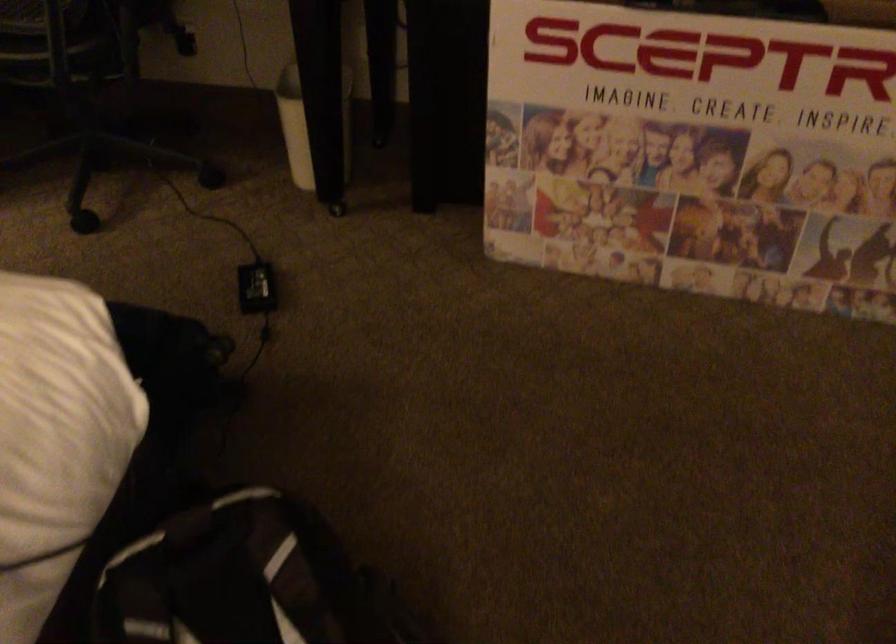
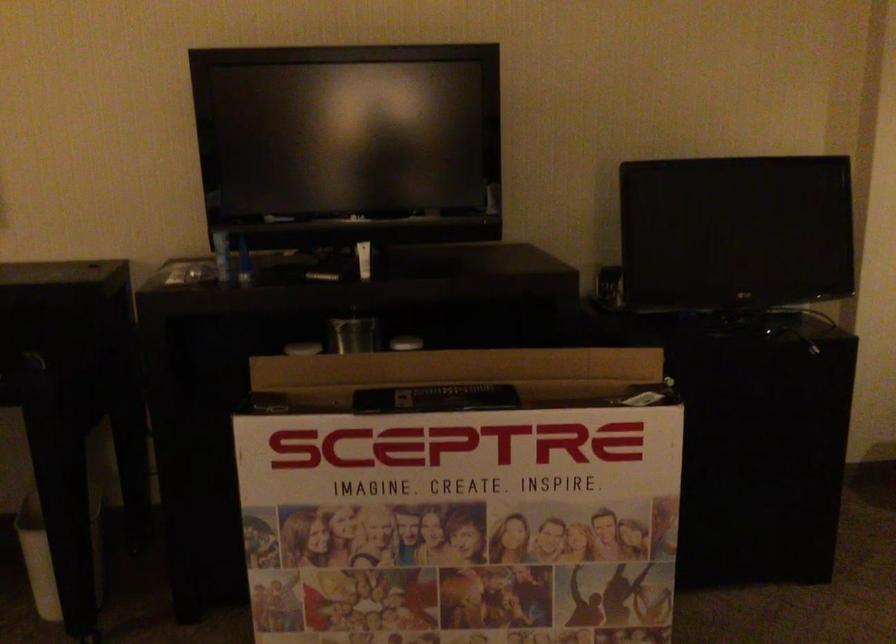
First-person continuous shooting, in which direction is the camera rotating?

The camera's rotation is toward right-up.